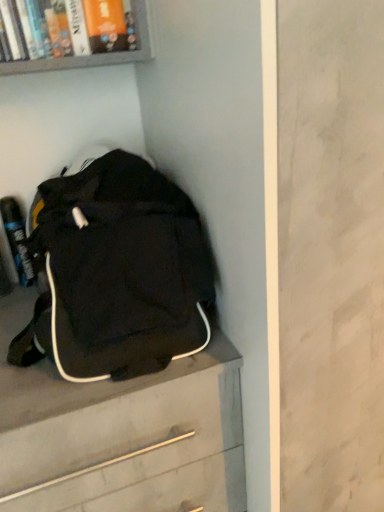
The width and height of the screenshot is (384, 512). Find the location of `black fabric backpack at lower left`. black fabric backpack at lower left is located at coordinates (117, 273).

This screenshot has height=512, width=384. What do you see at coordinates (117, 273) in the screenshot?
I see `black fabric backpack at lower left` at bounding box center [117, 273].

Measure the distance between black fabric chest of drawers at lower left and camera.

A distance of 65.58 centimeters exists between black fabric chest of drawers at lower left and camera.

This screenshot has height=512, width=384. Identify the location of black fabric chest of drawers at lower left. (113, 426).

The height and width of the screenshot is (512, 384). What do you see at coordinates (113, 426) in the screenshot?
I see `black fabric chest of drawers at lower left` at bounding box center [113, 426].

Where is `black fabric backpack at lower left`? This screenshot has height=512, width=384. black fabric backpack at lower left is located at coordinates (117, 273).

Considering the relative positions of black fabric chest of drawers at lower left and black fabric backpack at lower left in the image provided, is black fabric chest of drawers at lower left to the left of black fabric backpack at lower left from the viewer's perspective?

Yes, black fabric chest of drawers at lower left is to the left of black fabric backpack at lower left.

Is black fabric chest of drawers at lower left positioned in front of black fabric backpack at lower left?

That is False.

Is point (45, 481) closer or farther from the camera than point (106, 304)?

Clearly, point (45, 481) is more distant from the camera than point (106, 304).

From the image's perspective, would you say black fabric chest of drawers at lower left is positioned over black fabric backpack at lower left?

No, from the image's perspective, black fabric chest of drawers at lower left is not above black fabric backpack at lower left.

From a real-world perspective, which object rests below the other?

black fabric chest of drawers at lower left.

In the scene shown: Is black fabric chest of drawers at lower left wider or thinner than black fabric backpack at lower left?

Clearly, black fabric chest of drawers at lower left has more width compared to black fabric backpack at lower left.

Can you confirm if black fabric chest of drawers at lower left is shorter than black fabric backpack at lower left?

No.

From the picture: Considering the sizes of black fabric chest of drawers at lower left and black fabric backpack at lower left in the image, is black fabric chest of drawers at lower left bigger or smaller than black fabric backpack at lower left?

black fabric chest of drawers at lower left is bigger than black fabric backpack at lower left.

Is black fabric chest of drawers at lower left spatially inside black fabric backpack at lower left, or outside of it?

black fabric chest of drawers at lower left cannot be found inside black fabric backpack at lower left.

Is black fabric chest of drawers at lower left far from black fabric backpack at lower left?

black fabric chest of drawers at lower left is actually quite close to black fabric backpack at lower left.

Consider the image. Is black fabric chest of drawers at lower left facing towards black fabric backpack at lower left?

No, black fabric chest of drawers at lower left is not turned towards black fabric backpack at lower left.

How many degrees apart are the facing directions of black fabric chest of drawers at lower left and black fabric backpack at lower left?

There is a 0.473-degree angle between the facing directions of black fabric chest of drawers at lower left and black fabric backpack at lower left.

How much distance is there between black fabric chest of drawers at lower left and black fabric backpack at lower left?

black fabric chest of drawers at lower left and black fabric backpack at lower left are 5.86 inches apart from each other.

In the image, there is a black fabric backpack at lower left. What are the coordinates of `the chest of drawers below it (from a real-world perspective)` in the screenshot? It's located at (113, 426).

Considering the positions of objects black fabric backpack at lower left and black fabric chest of drawers at lower left in the image provided, who is more to the right, black fabric backpack at lower left or black fabric chest of drawers at lower left?

From the viewer's perspective, black fabric backpack at lower left appears more on the right side.

Relative to black fabric chest of drawers at lower left, is black fabric backpack at lower left in front or behind?

Visually, black fabric backpack at lower left is located in front of black fabric chest of drawers at lower left.

Considering the points (90, 203) and (6, 453), which point is behind, point (90, 203) or point (6, 453)?

Point (90, 203)

From the image's perspective, is black fabric backpack at lower left under black fabric chest of drawers at lower left?

No.

From a real-world perspective, is black fabric backpack at lower left above or below black fabric chest of drawers at lower left?

From a real-world perspective, black fabric backpack at lower left is physically above black fabric chest of drawers at lower left.

Can you confirm if black fabric backpack at lower left is thinner than black fabric chest of drawers at lower left?

Yes, black fabric backpack at lower left is thinner than black fabric chest of drawers at lower left.

Between black fabric backpack at lower left and black fabric chest of drawers at lower left, which one has more height?

black fabric chest of drawers at lower left is taller.

Is black fabric backpack at lower left smaller than black fabric chest of drawers at lower left?

Yes.

Is black fabric chest of drawers at lower left completely or partially inside black fabric backpack at lower left?

No, black fabric chest of drawers at lower left is located outside of black fabric backpack at lower left.

Is black fabric backpack at lower left positioned far away from black fabric chest of drawers at lower left?

No, there isn't a large distance between black fabric backpack at lower left and black fabric chest of drawers at lower left.

Does black fabric backpack at lower left turn towards black fabric chest of drawers at lower left?

No.

This screenshot has width=384, height=512. What are the coordinates of `the chest of drawers beneath the black fabric backpack at lower left (from a real-world perspective)` in the screenshot? It's located at coord(113,426).

Identify the location of backpack in front of the black fabric chest of drawers at lower left. This screenshot has width=384, height=512. (117, 273).

You are a GUI agent. You are given a task and a screenshot of the screen. Output one action in this format:
    pyautogui.click(x=<x>, y=<y>)
    Task: Click on the chest of drawers on the left of black fabric backpack at lower left
    Image resolution: width=384 pixels, height=512 pixels.
    Given the screenshot: What is the action you would take?
    (x=113, y=426)